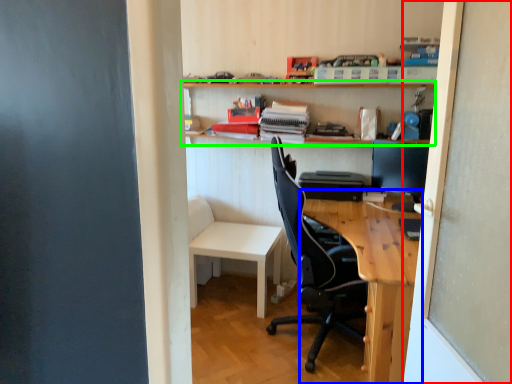
Question: Which object is positioned farthest from screen door (highlighted by a red box)? Select from desk (highlighted by a blue box) and shelf (highlighted by a green box).

Choices:
 (A) desk
 (B) shelf

Answer: (B)